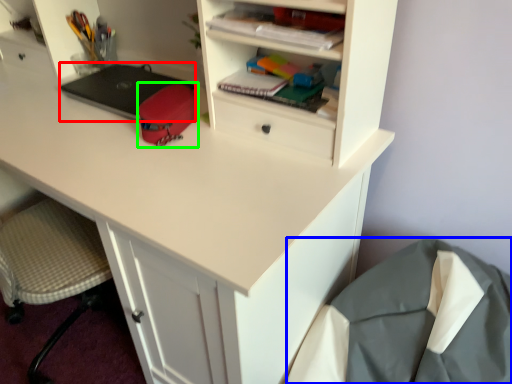
Question: Based on their relative distances, which object is nearer to laptop (highlighted by a red box)? Choose from sleeping bag (highlighted by a blue box) and stationery (highlighted by a green box).

Choices:
 (A) sleeping bag
 (B) stationery

Answer: (B)